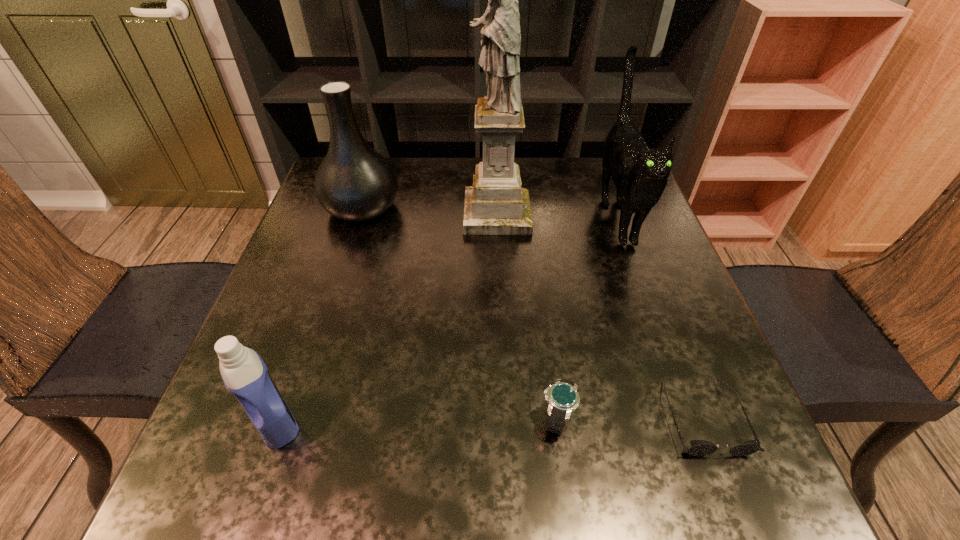
Identify the location of vacant position located on the right of the vase. Image resolution: width=960 pixels, height=540 pixels. (454, 208).

This screenshot has height=540, width=960. Identify the location of free point located 0.290m on the right of the fourth tallest object. (478, 421).

Locate an element on the screen. The image size is (960, 540). free region located 0.270m on the left of the second shortest object is located at coordinates (379, 417).

At what (x,y) coordinates should I click in order to perform the action: click on vacant area situated on the front-facing side of the sunglasses. Please return your answer as a coordinate pair (x, y). This screenshot has height=540, width=960. Looking at the image, I should click on (737, 506).

Identify the location of sculpture that is positioned at the far edge. The height and width of the screenshot is (540, 960). (496, 204).

You are a GUI agent. You are given a task and a screenshot of the screen. Output one action in this format:
    pyautogui.click(x=<x>, y=<y>)
    Task: Click on the cat positioned at the far edge
    
    Given the screenshot: What is the action you would take?
    pyautogui.click(x=640, y=174)

The image size is (960, 540). In order to click on vase present at the far edge in this screenshot , I will do `click(354, 182)`.

This screenshot has height=540, width=960. Identify the location of detergent present at the near edge. (244, 373).

The image size is (960, 540). I want to click on sunglasses at the near edge, so click(x=698, y=447).

Image resolution: width=960 pixels, height=540 pixels. Find the location of `vase that is positioned at the left edge`. vase that is positioned at the left edge is located at coordinates (354, 182).